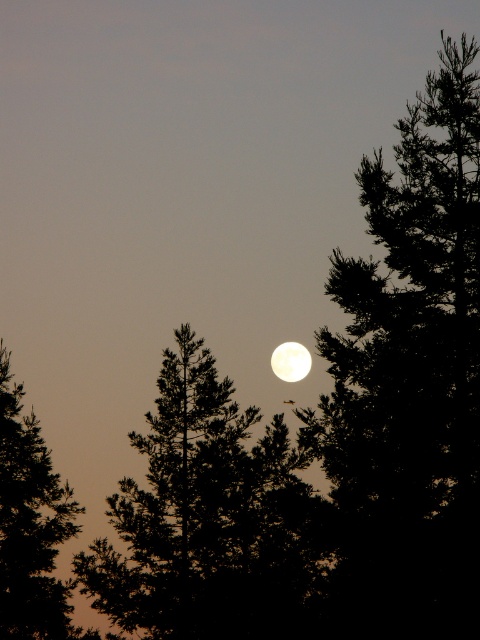
Looking at this image, does silhouette tree at right have a greater height compared to dark green leafy tree at left?

In fact, silhouette tree at right may be shorter than dark green leafy tree at left.

From the picture: Can you confirm if silhouette tree at right is wider than dark green leafy tree at left?

In fact, silhouette tree at right might be narrower than dark green leafy tree at left.

The width and height of the screenshot is (480, 640). Find the location of `silhouette tree at right`. silhouette tree at right is located at coordinates (408, 380).

Is point (303, 605) closer to camera compared to point (34, 592)?

Yes.

At what (x,y) coordinates should I click in order to perform the action: click on silhouette pine tree at center. Please return your answer as a coordinate pair (x, y). The image size is (480, 640). Looking at the image, I should click on (210, 520).

Which is below, silhouette pine tree at center or bright white sphere at center?

silhouette pine tree at center is below.

What do you see at coordinates (210, 520) in the screenshot? This screenshot has height=640, width=480. I see `silhouette pine tree at center` at bounding box center [210, 520].

Image resolution: width=480 pixels, height=640 pixels. What do you see at coordinates (210, 520) in the screenshot?
I see `silhouette pine tree at center` at bounding box center [210, 520].

Find the location of a particular element. The height and width of the screenshot is (640, 480). silhouette pine tree at center is located at coordinates (210, 520).